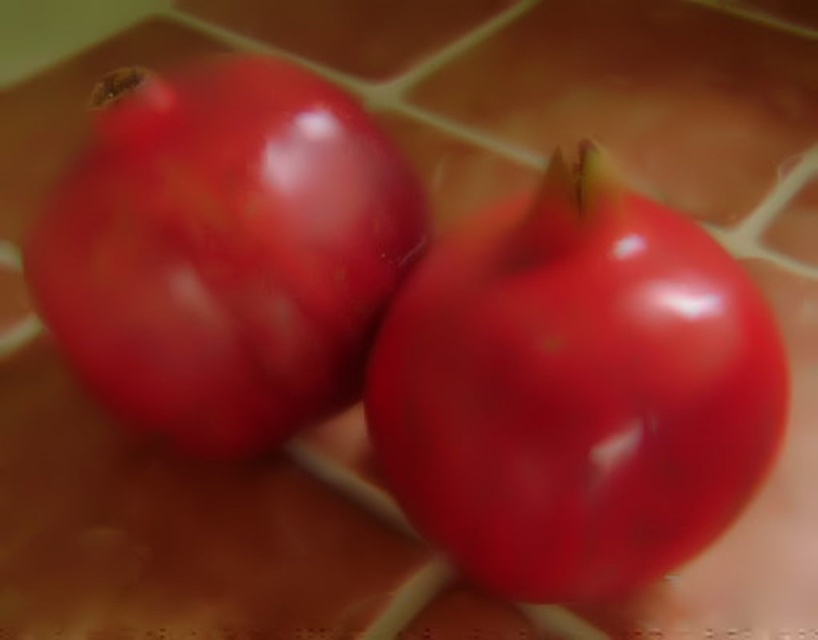
You are arranging tomatoes on a plate and need to know their sizes. Which tomato is shorter between the glossy red tomato at center and the glossy red tomato at left?

The glossy red tomato at center is shorter than the glossy red tomato at left.